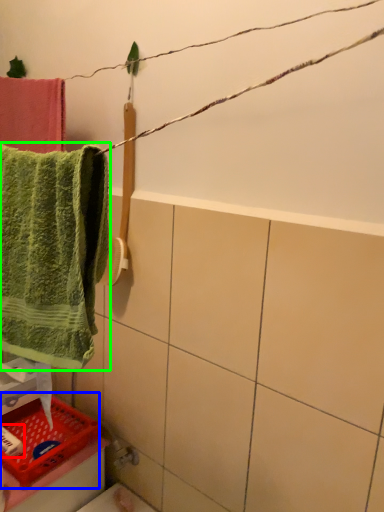
Question: Which is nearer to the toiletry (highlighted by a red box)? basket (highlighted by a blue box) or towel (highlighted by a green box).

Choices:
 (A) basket
 (B) towel

Answer: (A)